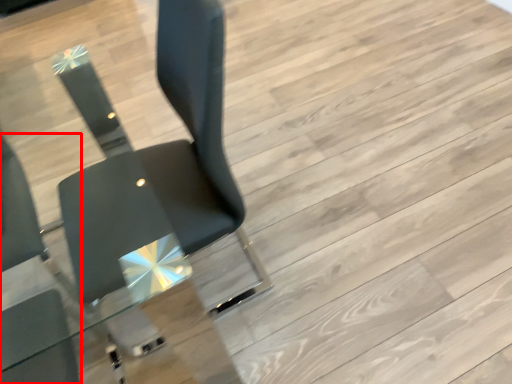
Question: From the image's perspective, what is the correct spatial positioning of chair (annotated by the red box) in reference to chair?

Choices:
 (A) below
 (B) above

Answer: (A)